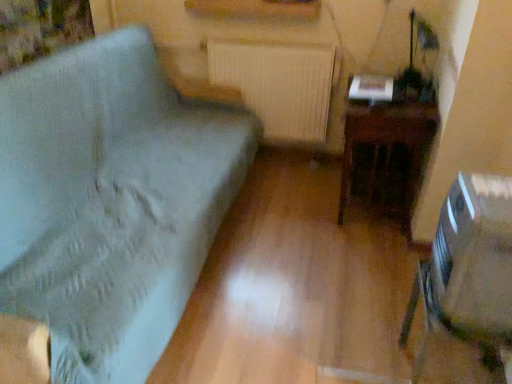
Question: Is clear plastic swivel chair at lower right bigger than dark wood table at right?

Choices:
 (A) no
 (B) yes

Answer: (A)

Question: Is clear plastic swivel chair at lower right smaller than dark wood table at right?

Choices:
 (A) yes
 (B) no

Answer: (A)

Question: From a real-world perspective, is clear plastic swivel chair at lower right below dark wood table at right?

Choices:
 (A) no
 (B) yes

Answer: (A)

Question: Is clear plastic swivel chair at lower right positioned behind dark wood table at right?

Choices:
 (A) no
 (B) yes

Answer: (A)

Question: Could you tell me if clear plastic swivel chair at lower right is facing dark wood table at right?

Choices:
 (A) yes
 (B) no

Answer: (B)

Question: Considering their positions, is white textured radiator at center located in front of or behind dark wood table at right?

Choices:
 (A) front
 (B) behind

Answer: (B)

Question: In terms of width, does white textured radiator at center look wider or thinner when compared to dark wood table at right?

Choices:
 (A) wide
 (B) thin

Answer: (B)

Question: In terms of height, does white textured radiator at center look taller or shorter compared to dark wood table at right?

Choices:
 (A) short
 (B) tall

Answer: (A)

Question: Would you say white textured radiator at center is inside or outside dark wood table at right?

Choices:
 (A) inside
 (B) outside

Answer: (B)

Question: Considering the positions of clear plastic swivel chair at lower right and white textured radiator at center in the image, is clear plastic swivel chair at lower right wider or thinner than white textured radiator at center?

Choices:
 (A) thin
 (B) wide

Answer: (B)

Question: Which is correct: clear plastic swivel chair at lower right is inside white textured radiator at center, or outside of it?

Choices:
 (A) inside
 (B) outside

Answer: (B)

Question: Considering the positions of clear plastic swivel chair at lower right and white textured radiator at center in the image, is clear plastic swivel chair at lower right bigger or smaller than white textured radiator at center?

Choices:
 (A) small
 (B) big

Answer: (A)

Question: From the image's perspective, is clear plastic swivel chair at lower right located above or below white textured radiator at center?

Choices:
 (A) above
 (B) below

Answer: (B)

Question: Do you think dark wood table at right is within light blue fabric cushion at left, or outside of it?

Choices:
 (A) outside
 (B) inside

Answer: (A)

Question: Considering the positions of dark wood table at right and light blue fabric cushion at left in the image, is dark wood table at right taller or shorter than light blue fabric cushion at left?

Choices:
 (A) tall
 (B) short

Answer: (B)